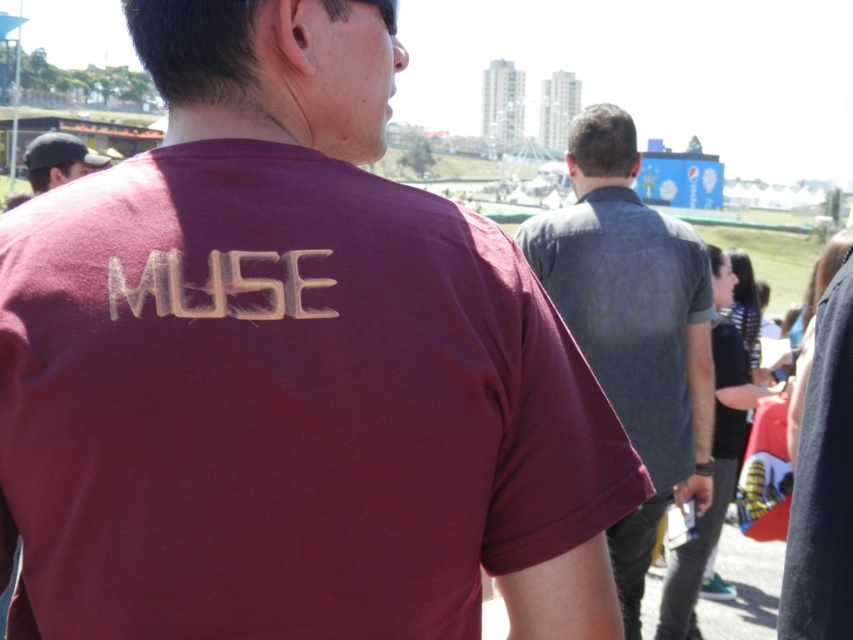
Question: Does denim shirt at center come behind matte black cap at upper left?

Choices:
 (A) yes
 (B) no

Answer: (B)

Question: Is maroon fabric t-shirt at center smaller than black fabric at center?

Choices:
 (A) yes
 (B) no

Answer: (A)

Question: Which point is farther to the camera?

Choices:
 (A) matte black cap at upper left
 (B) denim shirt at center
 (C) black fabric at center

Answer: (A)

Question: Which of the following is the farthest from the observer?

Choices:
 (A) (836, 358)
 (B) (73, 429)
 (C) (659, 480)
 (D) (44, 182)

Answer: (D)

Question: Does black fabric at center lie in front of matte black cap at upper left?

Choices:
 (A) yes
 (B) no

Answer: (A)

Question: Which of the following is the farthest from the observer?

Choices:
 (A) (578, 413)
 (B) (846, 570)
 (C) (660, 440)
 (D) (77, 154)

Answer: (D)